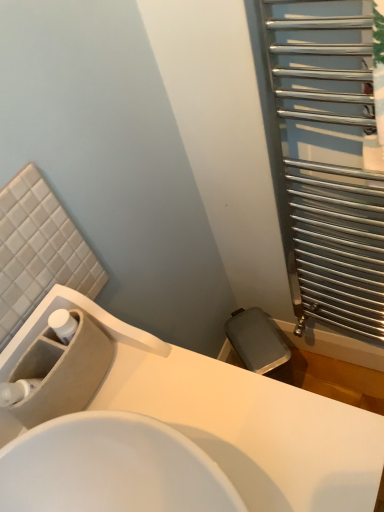
Question: Considering the relative positions of silver metallic radiator at right and white glossy sink at center, which is the second sink from back to front, in the image provided, is silver metallic radiator at right to the right of white glossy sink at center, which is the second sink from back to front, from the viewer's perspective?

Choices:
 (A) no
 (B) yes

Answer: (B)

Question: Is silver metallic radiator at right taller than white glossy sink at center, the 1th sink in the front-to-back sequence?

Choices:
 (A) yes
 (B) no

Answer: (A)

Question: From the image's perspective, is silver metallic radiator at right located above white glossy sink at center, which is the second sink from back to front?

Choices:
 (A) yes
 (B) no

Answer: (A)

Question: Are silver metallic radiator at right and white glossy sink at center, the 1th sink in the front-to-back sequence, far apart?

Choices:
 (A) yes
 (B) no

Answer: (B)

Question: Can you confirm if silver metallic radiator at right is positioned to the left of white glossy sink at center, the 1th sink in the front-to-back sequence?

Choices:
 (A) no
 (B) yes

Answer: (A)

Question: Can you see silver metallic radiator at right touching white glossy sink at center, which is the second sink from back to front?

Choices:
 (A) no
 (B) yes

Answer: (A)

Question: Does beige matte sink at lower left, placed as the first sink when sorted from back to front, turn towards silver metallic radiator at right?

Choices:
 (A) yes
 (B) no

Answer: (B)

Question: Is beige matte sink at lower left, placed as the first sink when sorted from back to front, bigger than silver metallic radiator at right?

Choices:
 (A) no
 (B) yes

Answer: (A)

Question: Considering the relative positions of beige matte sink at lower left, which is the 2th sink in front-to-back order, and silver metallic radiator at right in the image provided, is beige matte sink at lower left, which is the 2th sink in front-to-back order, behind silver metallic radiator at right?

Choices:
 (A) yes
 (B) no

Answer: (B)

Question: Considering the relative sizes of beige matte sink at lower left, which is the 2th sink in front-to-back order, and silver metallic radiator at right in the image provided, is beige matte sink at lower left, which is the 2th sink in front-to-back order, shorter than silver metallic radiator at right?

Choices:
 (A) yes
 (B) no

Answer: (A)

Question: Is beige matte sink at lower left, which is the 2th sink in front-to-back order, at the right side of silver metallic radiator at right?

Choices:
 (A) yes
 (B) no

Answer: (B)

Question: Does beige matte sink at lower left, placed as the first sink when sorted from back to front, contain silver metallic radiator at right?

Choices:
 (A) no
 (B) yes

Answer: (A)

Question: Is white glossy sink at center, which is the second sink from back to front, to the left of silver metallic radiator at right from the viewer's perspective?

Choices:
 (A) yes
 (B) no

Answer: (A)